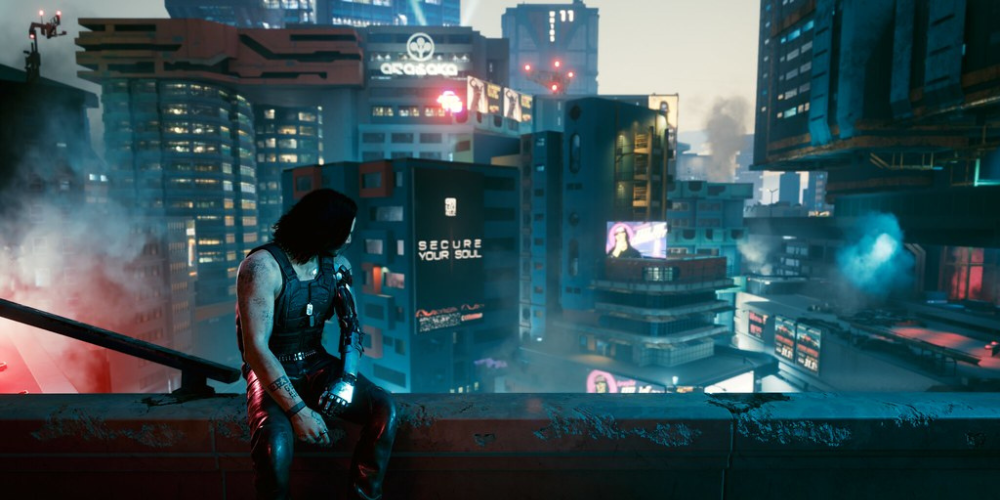
This screenshot has height=500, width=1000. What are the coordinates of `digital screen` in the screenshot? It's located at (644, 238), (263, 459).